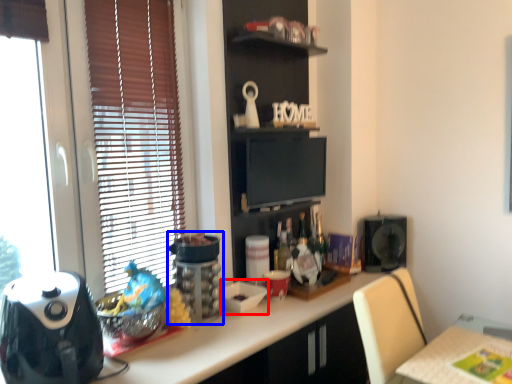
Question: Which point is further to the camera, appliance (highlighted by a red box) or appliance (highlighted by a blue box)?

Choices:
 (A) appliance
 (B) appliance

Answer: (A)